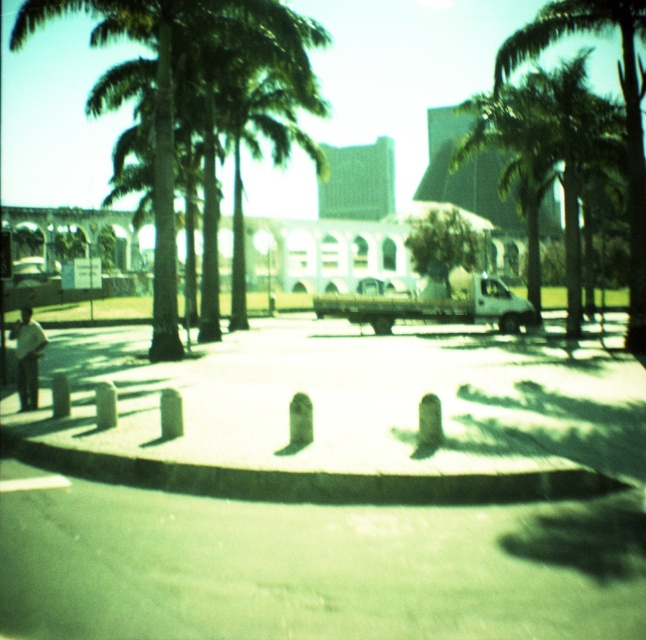
You are standing in the middle of the paved area and want to know which palm tree is taller. Can you determine which one is taller between the green leafy palm tree at center and the green leafy palm tree at upper right?

The green leafy palm tree at center is taller than the green leafy palm tree at upper right.

You are a delivery driver trying to park your white matte truck at center in a parking spot that can only accommodate vehicles smaller than the green leafy tree at center. Can your truck fit in the spot?

The white matte truck at center has a smaller size compared to the green leafy tree at center, so yes, the truck can fit in the parking spot since it is smaller than the tree.